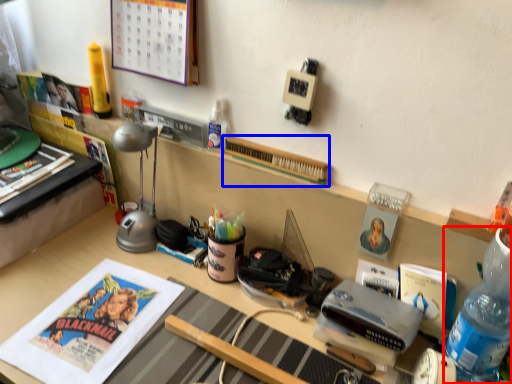
Question: Among these objects, which one is farthest to the camera, bottle (highlighted by a red box) or book (highlighted by a blue box)?

Choices:
 (A) bottle
 (B) book

Answer: (B)